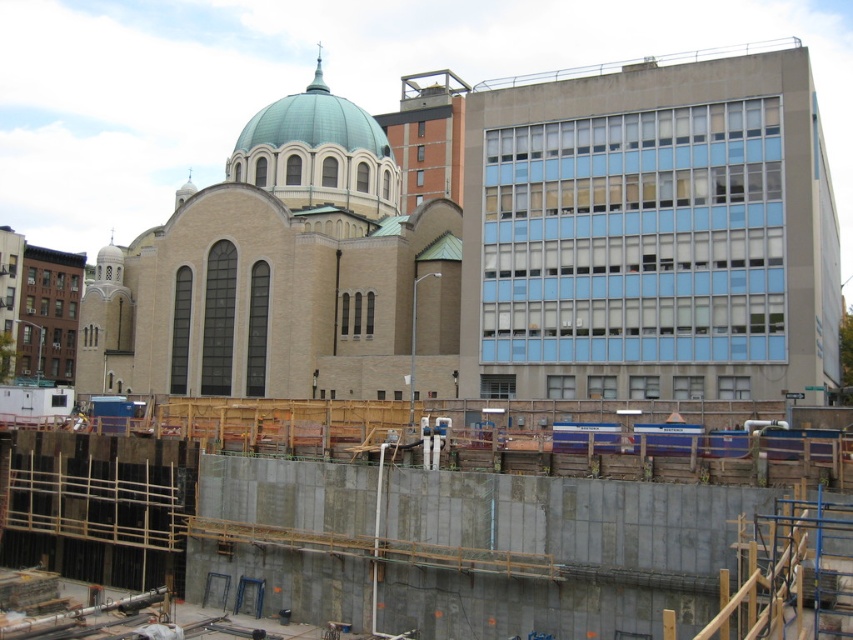
Question: Which point is farther to the camera?

Choices:
 (A) (194, 337)
 (B) (698, 621)

Answer: (A)

Question: From the image, what is the correct spatial relationship of beige stone church at center in relation to concrete wall at center?

Choices:
 (A) above
 (B) below

Answer: (A)

Question: Which point is closer to the camera taking this photo?

Choices:
 (A) (729, 364)
 (B) (531, 515)

Answer: (B)

Question: Among these objects, which one is nearest to the camera?

Choices:
 (A) beige stone church at center
 (B) concrete wall at center

Answer: (B)

Question: Does beige stone church at center have a larger size compared to concrete wall at center?

Choices:
 (A) yes
 (B) no

Answer: (A)

Question: In this image, where is beige stone church at center located relative to concrete wall at center?

Choices:
 (A) above
 (B) below

Answer: (A)